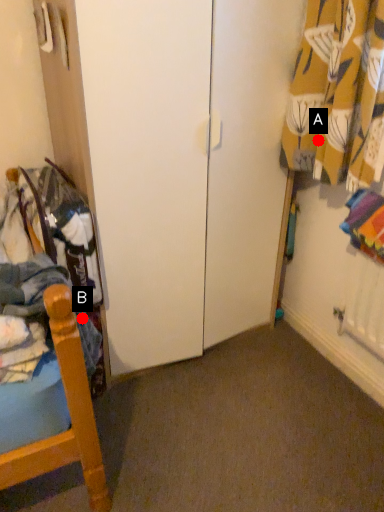
Question: Two points are circled on the image, labeled by A and B beside each circle. Which point is further to the camera?

Choices:
 (A) A is further
 (B) B is further

Answer: (A)